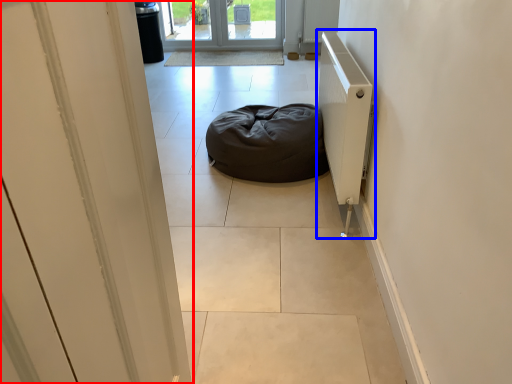
Question: Which point is closer to the camera, door (highlighted by a red box) or radiator (highlighted by a blue box)?

Choices:
 (A) door
 (B) radiator

Answer: (A)